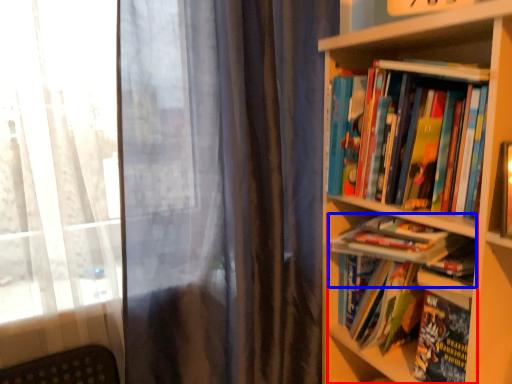
Question: Which object appears farthest to the camera in this image, book (highlighted by a red box) or book (highlighted by a blue box)?

Choices:
 (A) book
 (B) book

Answer: (B)